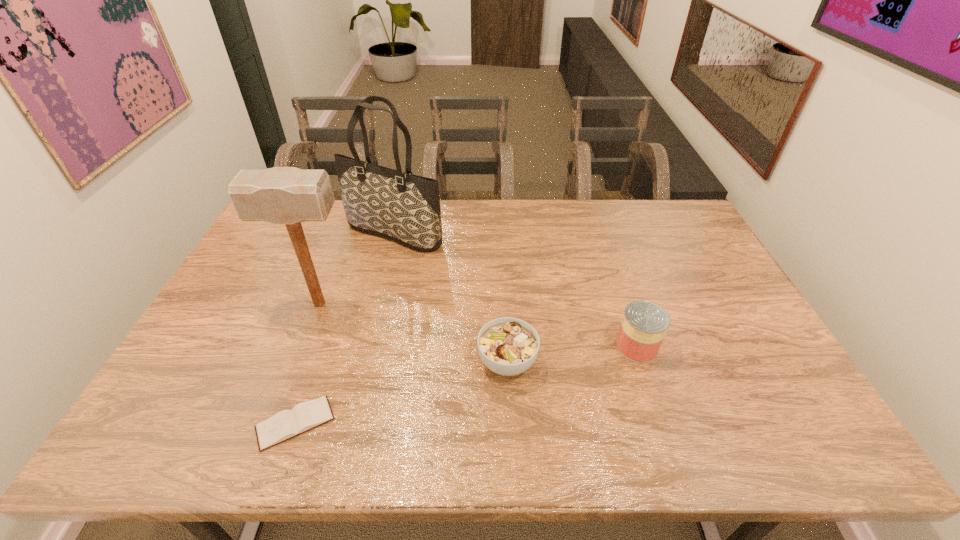
Where is `free space that satisfies the following two spatial constraints: 1. on the back side of the tote bag; 2. on the left side of the diary`? This screenshot has height=540, width=960. free space that satisfies the following two spatial constraints: 1. on the back side of the tote bag; 2. on the left side of the diary is located at coordinates (359, 234).

I want to click on free spot that satisfies the following two spatial constraints: 1. on the front side of the third shortest object; 2. on the left side of the tote bag, so click(367, 346).

Find the location of a particular element. The height and width of the screenshot is (540, 960). blank area in the image that satisfies the following two spatial constraints: 1. on the striking face of the third tallest object; 2. on the right side of the mallet is located at coordinates (303, 346).